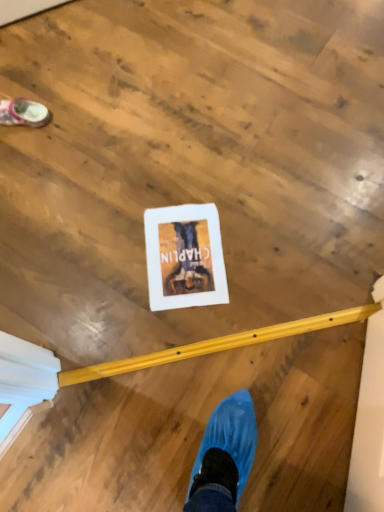
Question: Can you confirm if white fabric shoe at upper left is shorter than white paper at center?

Choices:
 (A) no
 (B) yes

Answer: (A)

Question: Does white fabric shoe at upper left appear on the right side of white paper at center?

Choices:
 (A) yes
 (B) no

Answer: (B)

Question: Does white fabric shoe at upper left have a smaller size compared to white paper at center?

Choices:
 (A) no
 (B) yes

Answer: (A)

Question: Is white fabric shoe at upper left oriented towards white paper at center?

Choices:
 (A) yes
 (B) no

Answer: (B)

Question: Is white fabric shoe at upper left directly adjacent to white paper at center?

Choices:
 (A) no
 (B) yes

Answer: (A)

Question: From a real-world perspective, is white fabric shoe at upper left on top of white paper at center?

Choices:
 (A) no
 (B) yes

Answer: (B)

Question: Considering the relative positions of white paper at center and white fabric shoe at upper left in the image provided, is white paper at center to the left of white fabric shoe at upper left from the viewer's perspective?

Choices:
 (A) yes
 (B) no

Answer: (B)

Question: Can you confirm if white paper at center is wider than white fabric shoe at upper left?

Choices:
 (A) no
 (B) yes

Answer: (B)

Question: Is white paper at center oriented away from white fabric shoe at upper left?

Choices:
 (A) no
 (B) yes

Answer: (A)

Question: Does white paper at center lie behind white fabric shoe at upper left?

Choices:
 (A) no
 (B) yes

Answer: (A)

Question: Can you confirm if white paper at center is taller than white fabric shoe at upper left?

Choices:
 (A) yes
 (B) no

Answer: (B)

Question: Does white paper at center have a lesser width compared to white fabric shoe at upper left?

Choices:
 (A) no
 (B) yes

Answer: (A)

Question: From a real-world perspective, is white fabric shoe at upper left above or below white paper at center?

Choices:
 (A) below
 (B) above

Answer: (B)